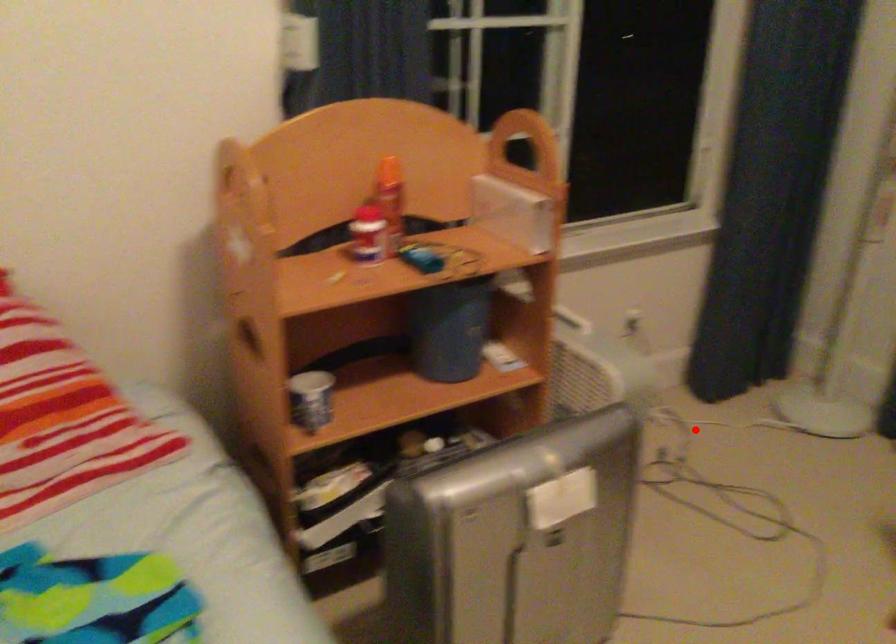
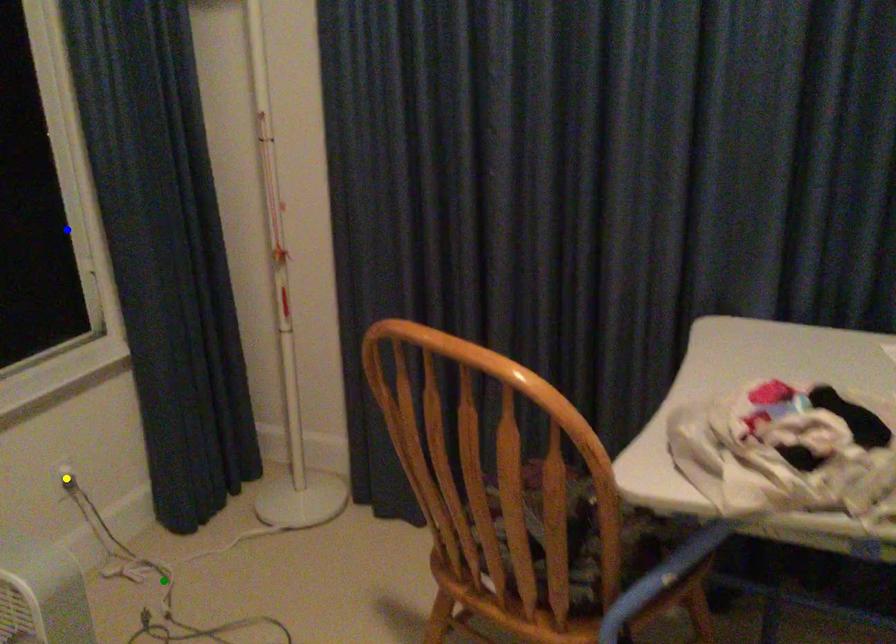
Question: I am providing you with two images of the same scene from different viewpoints. A red point is marked on the first image. You are given multiple points on the second image. Which point in image 2 is actually the same real-world point as the red point in image 1?

Choices:
 (A) green point
 (B) blue point
 (C) yellow point

Answer: (A)